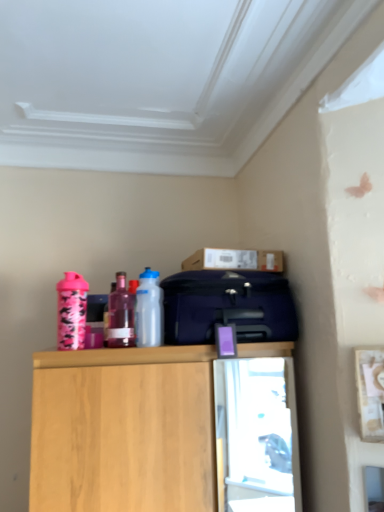
Question: From the image's perspective, is matte blue suitcase at center located above wooden cabinet at upper center?

Choices:
 (A) no
 (B) yes

Answer: (B)

Question: Does matte blue suitcase at center have a lesser height compared to wooden cabinet at upper center?

Choices:
 (A) no
 (B) yes

Answer: (B)

Question: Is matte blue suitcase at center outside of wooden cabinet at upper center?

Choices:
 (A) no
 (B) yes

Answer: (B)

Question: Does matte blue suitcase at center have a lesser width compared to wooden cabinet at upper center?

Choices:
 (A) no
 (B) yes

Answer: (B)

Question: From a real-world perspective, is matte blue suitcase at center on wooden cabinet at upper center?

Choices:
 (A) no
 (B) yes

Answer: (B)

Question: From the image's perspective, would you say matte blue suitcase at center is shown under wooden cabinet at upper center?

Choices:
 (A) no
 (B) yes

Answer: (A)

Question: Is translucent purple bottle at center, placed as the 2th bottle when sorted from left to right, to the left of wooden cabinet at upper center from the viewer's perspective?

Choices:
 (A) no
 (B) yes

Answer: (B)

Question: Considering the relative sizes of translucent purple bottle at center, marked as the second bottle in a right-to-left arrangement, and wooden cabinet at upper center in the image provided, is translucent purple bottle at center, marked as the second bottle in a right-to-left arrangement, bigger than wooden cabinet at upper center?

Choices:
 (A) no
 (B) yes

Answer: (A)

Question: Is translucent purple bottle at center, placed as the 2th bottle when sorted from left to right, surrounding wooden cabinet at upper center?

Choices:
 (A) yes
 (B) no

Answer: (B)

Question: From a real-world perspective, is translucent purple bottle at center, marked as the second bottle in a right-to-left arrangement, beneath wooden cabinet at upper center?

Choices:
 (A) yes
 (B) no

Answer: (B)

Question: Considering the relative positions of translucent purple bottle at center, marked as the second bottle in a right-to-left arrangement, and wooden cabinet at upper center in the image provided, is translucent purple bottle at center, marked as the second bottle in a right-to-left arrangement, in front of wooden cabinet at upper center?

Choices:
 (A) yes
 (B) no

Answer: (B)

Question: Is cardboard box at upper center closer to the viewer compared to translucent purple bottle at center, placed as the 2th bottle when sorted from left to right?

Choices:
 (A) no
 (B) yes

Answer: (A)